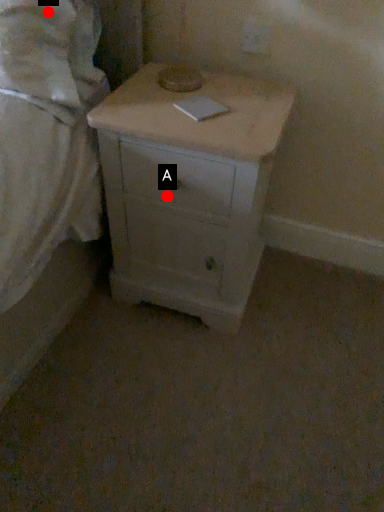
Question: Two points are circled on the image, labeled by A and B beside each circle. Among these points, which one is nearest to the camera?

Choices:
 (A) A is closer
 (B) B is closer

Answer: (B)